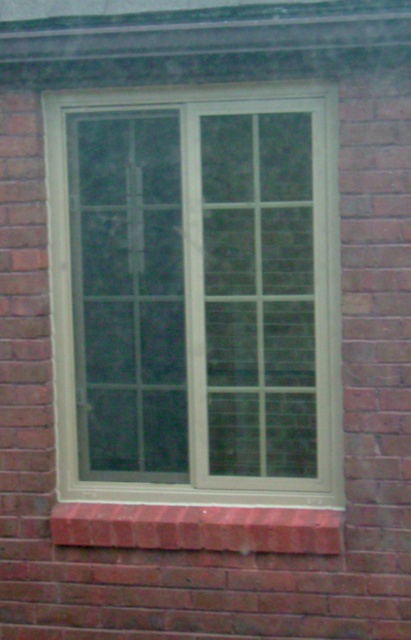
You are standing in front of a building with a window. There is a point at coordinates (x=196, y=294). What is located at that point?

At point (x=196, y=294) lies the white plastic window at center.